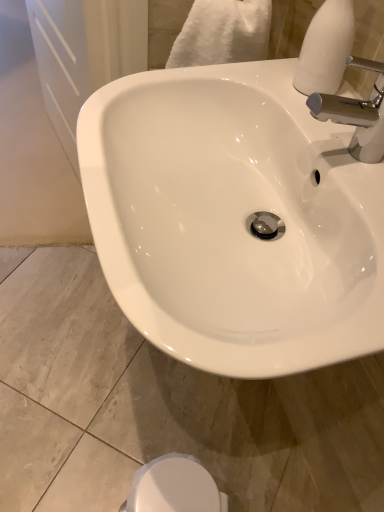
Question: From the image's perspective, does white matte soap dispenser at upper right appear higher than white glossy bidet at lower center?

Choices:
 (A) no
 (B) yes

Answer: (B)

Question: From the image's perspective, is white matte soap dispenser at upper right under white glossy bidet at lower center?

Choices:
 (A) no
 (B) yes

Answer: (A)

Question: From a real-world perspective, does white matte soap dispenser at upper right sit lower than white glossy bidet at lower center?

Choices:
 (A) no
 (B) yes

Answer: (A)

Question: Considering the relative sizes of white matte soap dispenser at upper right and white glossy bidet at lower center in the image provided, is white matte soap dispenser at upper right smaller than white glossy bidet at lower center?

Choices:
 (A) yes
 (B) no

Answer: (A)

Question: Is the depth of white matte soap dispenser at upper right less than that of white glossy bidet at lower center?

Choices:
 (A) yes
 (B) no

Answer: (A)

Question: From a real-world perspective, is white glossy bidet at lower center above or below chrome metallic faucet at upper right?

Choices:
 (A) below
 (B) above

Answer: (A)

Question: In terms of size, does white glossy bidet at lower center appear bigger or smaller than chrome metallic faucet at upper right?

Choices:
 (A) small
 (B) big

Answer: (B)

Question: Is white glossy bidet at lower center in front of or behind chrome metallic faucet at upper right in the image?

Choices:
 (A) front
 (B) behind

Answer: (B)

Question: From the image's perspective, is white glossy bidet at lower center positioned above or below chrome metallic faucet at upper right?

Choices:
 (A) above
 (B) below

Answer: (B)

Question: From a real-world perspective, is chrome metallic faucet at upper right physically located above or below white glossy bidet at lower center?

Choices:
 (A) below
 (B) above

Answer: (B)

Question: In terms of size, does chrome metallic faucet at upper right appear bigger or smaller than white glossy bidet at lower center?

Choices:
 (A) small
 (B) big

Answer: (A)

Question: Looking at their shapes, would you say chrome metallic faucet at upper right is wider or thinner than white glossy bidet at lower center?

Choices:
 (A) wide
 (B) thin

Answer: (B)

Question: Considering the positions of chrome metallic faucet at upper right and white glossy bidet at lower center in the image, is chrome metallic faucet at upper right taller or shorter than white glossy bidet at lower center?

Choices:
 (A) short
 (B) tall

Answer: (A)

Question: From a real-world perspective, relative to white glossy bidet at lower center, is white matte soap dispenser at upper right vertically above or below?

Choices:
 (A) below
 (B) above

Answer: (B)

Question: Considering the positions of point (349, 28) and point (216, 502), is point (349, 28) closer or farther from the camera than point (216, 502)?

Choices:
 (A) farther
 (B) closer

Answer: (B)